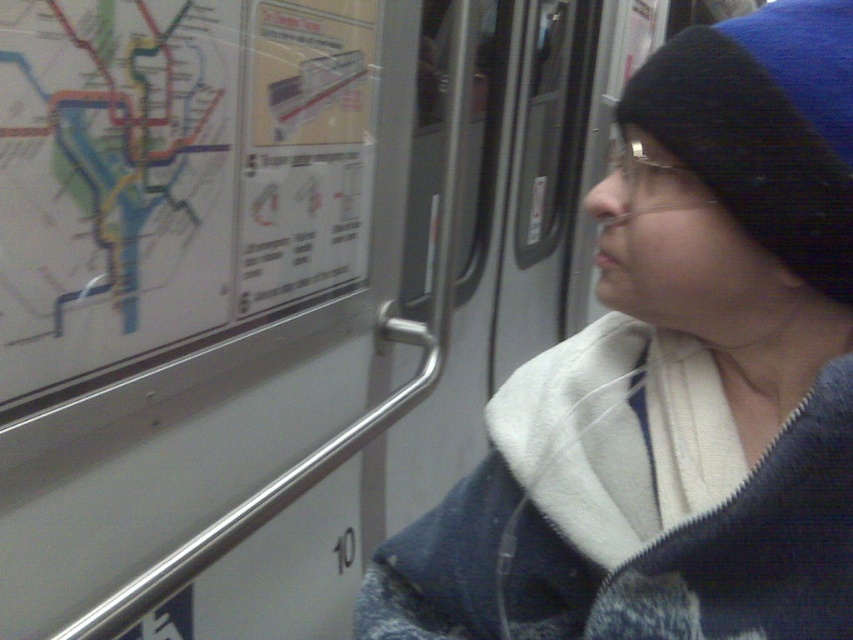
You are a passenger in the subway car and want to know if the blue knit beanie at upper right and the blue knit hat at upper right are close enough to fit both in a 6 inch wide bag compartment. Can they fit together?

The blue knit beanie at upper right and the blue knit hat at upper right are 5.21 inches apart from each other, so they can fit together in the 6 inch wide bag compartment since the combined width is less than 6 inches.

You are standing at the point marked as point (676, 378) in the subway car. You want to place a small bag on the floor near the blue knit beanie at upper right. Is there enough space to place the bag there?

The blue knit beanie at upper right is located at point (676, 378), so placing a small bag near that point should be possible as long as there is no obstruction. However, since the scene description does not mention any specific obstructions at that location, it is likely feasible.

You are standing inside the subway car and notice two points marked on the window. The first point is at coordinate point (701,557) and the second is at point (26,342). Which point is closer to you?

Point (701,557) is closer to the viewer than point (26,342).